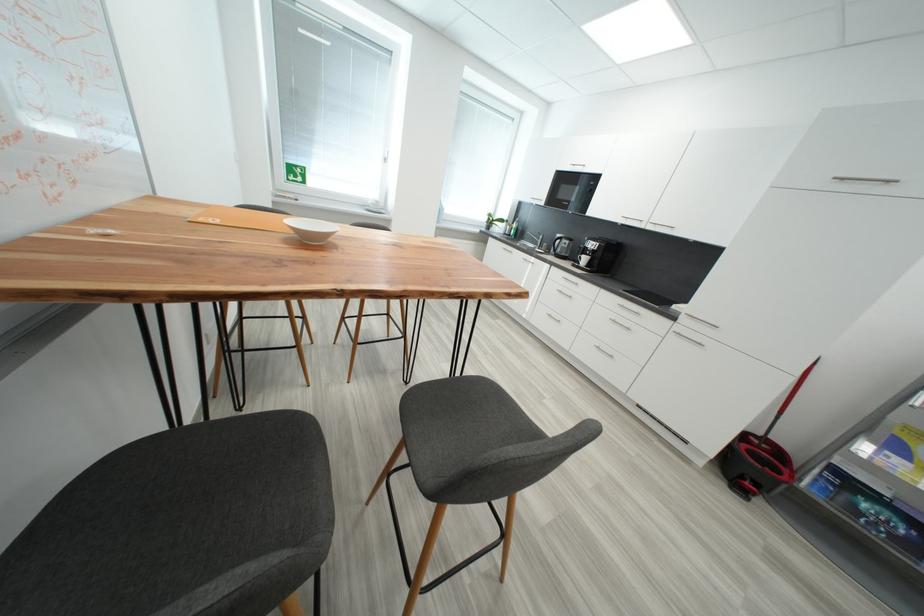
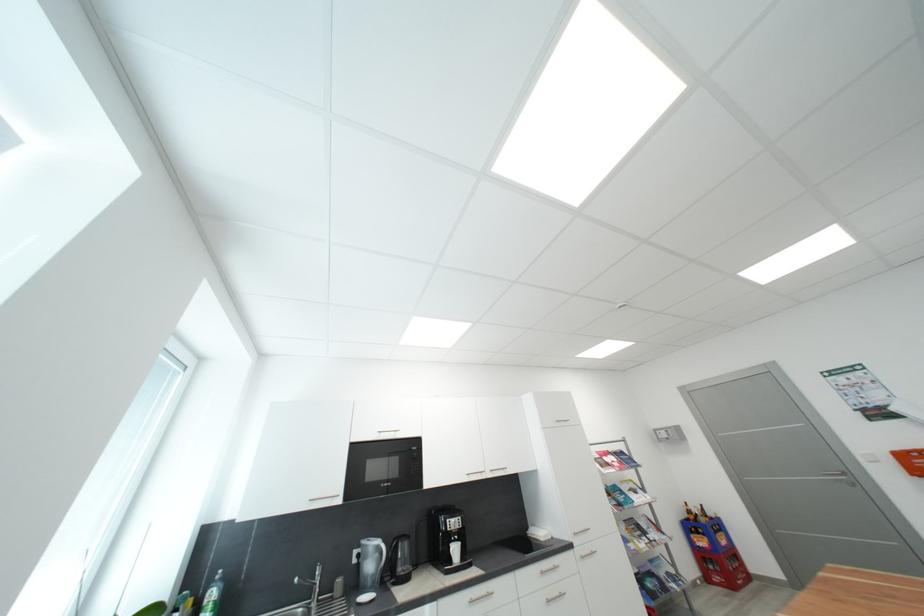
In the second image, find the point that corresponds to [591,261] in the first image.

(463, 552)